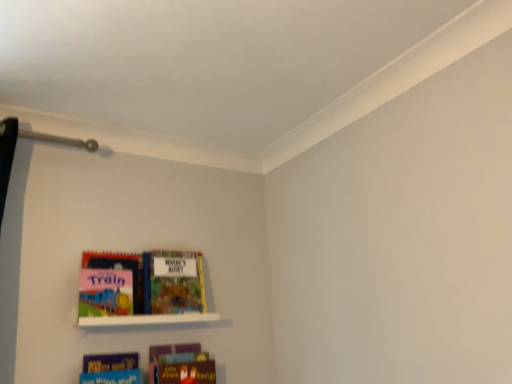
Question: Is blue matte book at lower center, which is the 2th book from bottom to top, positioned beyond the bounds of matte board book at left, which ranks as the fourth book in bottom-to-top order?

Choices:
 (A) yes
 (B) no

Answer: (A)

Question: Can you confirm if blue matte book at lower center, which is the 2th book from bottom to top, is thinner than matte board book at left, which ranks as the fourth book in bottom-to-top order?

Choices:
 (A) yes
 (B) no

Answer: (A)

Question: From the image's perspective, is blue matte book at lower center, placed as the third book when sorted from top to bottom, below matte board book at left, the 1th book viewed from the top?

Choices:
 (A) no
 (B) yes

Answer: (B)

Question: Is blue matte book at lower center, which is the 2th book from bottom to top, facing towards matte board book at left, which ranks as the fourth book in bottom-to-top order?

Choices:
 (A) yes
 (B) no

Answer: (B)

Question: From a real-world perspective, is blue matte book at lower center, placed as the third book when sorted from top to bottom, on top of matte board book at left, the 1th book viewed from the top?

Choices:
 (A) no
 (B) yes

Answer: (A)

Question: Is blue matte book at lower center, which is the 2th book from bottom to top, behind matte board book at left, which ranks as the fourth book in bottom-to-top order?

Choices:
 (A) yes
 (B) no

Answer: (B)

Question: From the image's perspective, is white matte shelf at lower left below blue matte book at lower center, which is the 2th book from bottom to top?

Choices:
 (A) yes
 (B) no

Answer: (B)

Question: Is white matte shelf at lower left wider than blue matte book at lower center, placed as the third book when sorted from top to bottom?

Choices:
 (A) yes
 (B) no

Answer: (A)

Question: Does white matte shelf at lower left have a lesser height compared to blue matte book at lower center, placed as the third book when sorted from top to bottom?

Choices:
 (A) yes
 (B) no

Answer: (A)

Question: Is white matte shelf at lower left facing away from blue matte book at lower center, placed as the third book when sorted from top to bottom?

Choices:
 (A) no
 (B) yes

Answer: (A)

Question: Is the position of white matte shelf at lower left more distant than that of blue matte book at lower center, which is the 2th book from bottom to top?

Choices:
 (A) yes
 (B) no

Answer: (A)

Question: Is blue matte book at lower center, placed as the third book when sorted from top to bottom, completely or partially inside white matte shelf at lower left?

Choices:
 (A) no
 (B) yes

Answer: (A)

Question: From a real-world perspective, is multicolored cardboard book at center, which appears as the third book when ordered from the bottom, on matte board book at left, the 1th book viewed from the top?

Choices:
 (A) no
 (B) yes

Answer: (B)